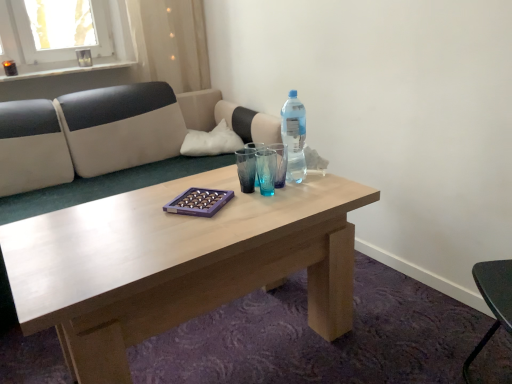
Locate an element on the screen. This screenshot has width=512, height=384. vacant space to the left of transparent glass vase at upper left is located at coordinates (60, 66).